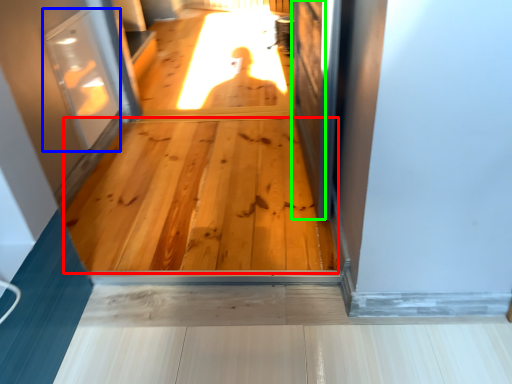
Question: Which object is positioned farthest from hardwood (highlighted by a red box)? Select from screen door (highlighted by a blue box) and screen door (highlighted by a green box).

Choices:
 (A) screen door
 (B) screen door

Answer: (A)